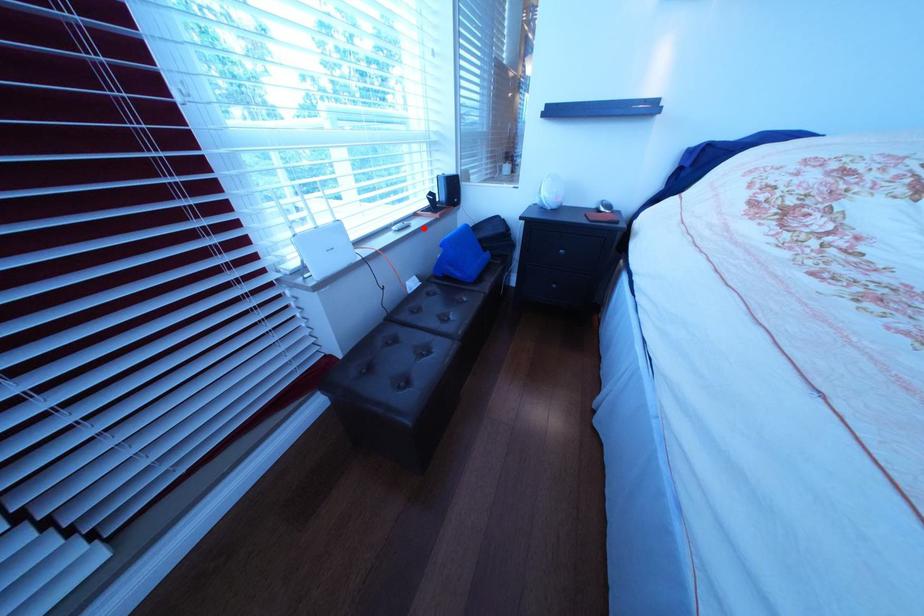
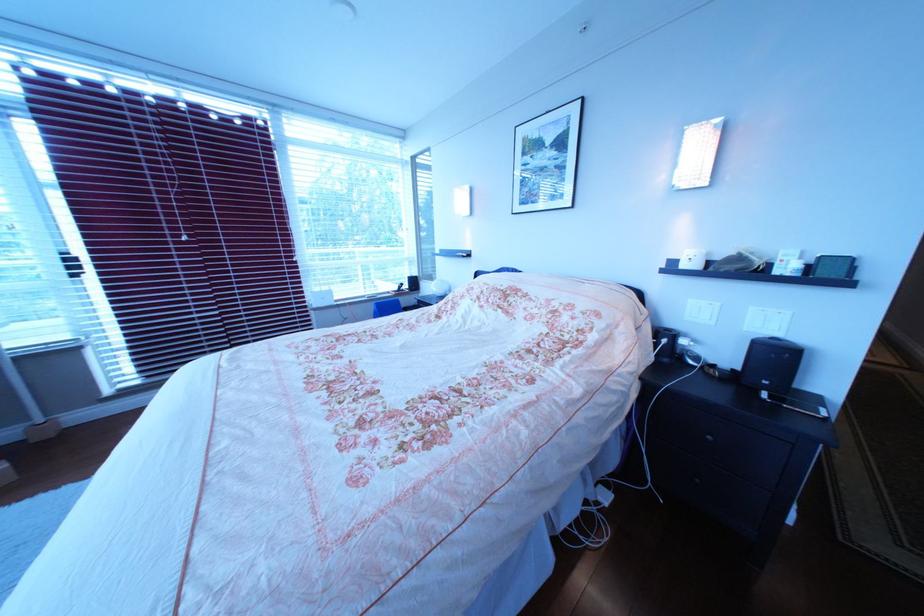
Find the pixel in the second image that matches the highlighted location in the first image.

(392, 299)